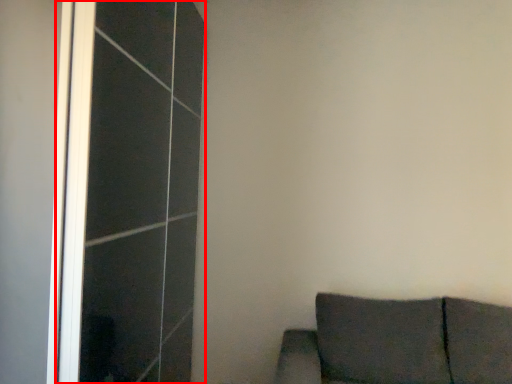
Question: From the image's perspective, considering the relative positions of screen door (annotated by the red box) and furniture in the image provided, where is screen door (annotated by the red box) located with respect to the staircase?

Choices:
 (A) above
 (B) below

Answer: (A)